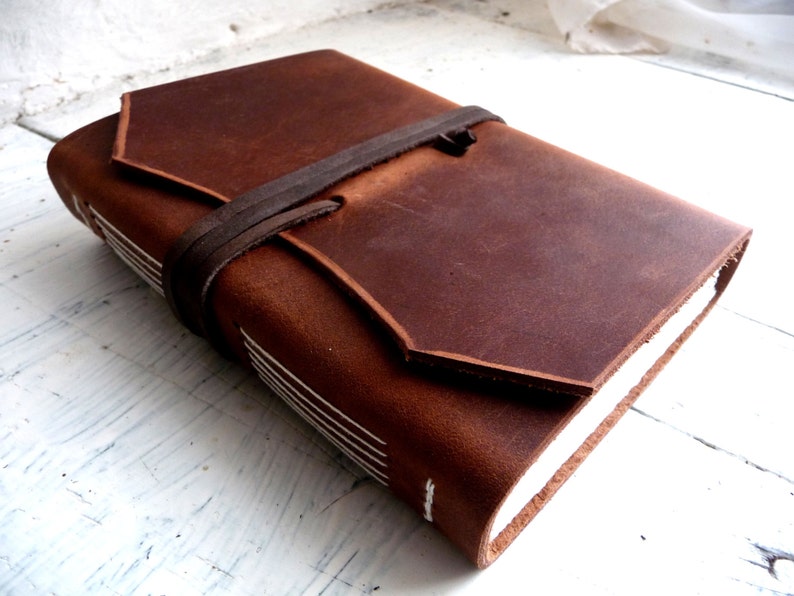
Find the location of a particular element. Image resolution: width=794 pixels, height=596 pixels. surface top is located at coordinates (216, 420).